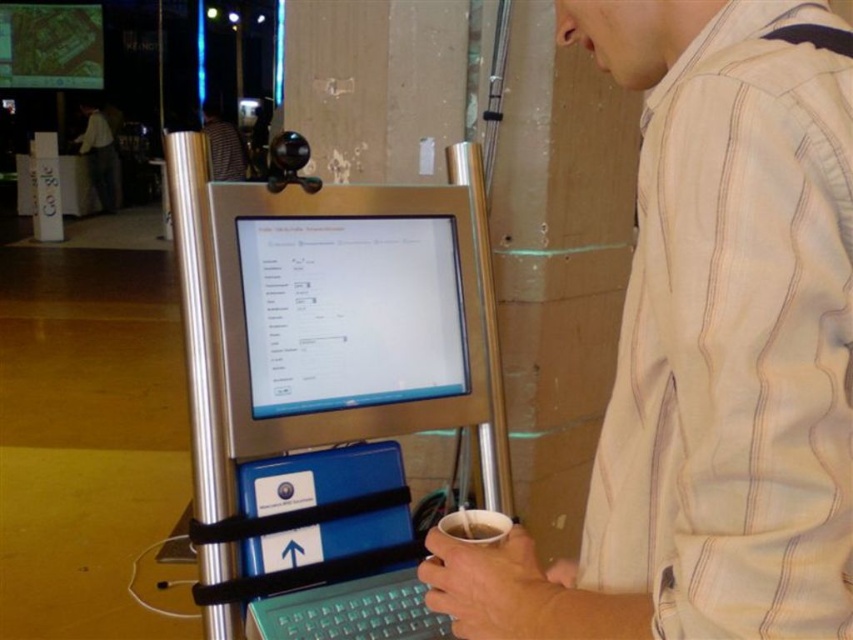
Question: Considering the relative positions of silver metallic computer at center and silver metallic computer monitor at center in the image provided, where is silver metallic computer at center located with respect to silver metallic computer monitor at center?

Choices:
 (A) left
 (B) right

Answer: (B)

Question: Which point appears farthest from the camera in this image?

Choices:
 (A) (227, 148)
 (B) (440, 524)
 (C) (200, 520)

Answer: (A)

Question: Which point is farther from the camera taking this photo?

Choices:
 (A) (468, 540)
 (B) (729, 483)
 (C) (204, 129)
 (D) (115, 168)

Answer: (D)

Question: Is silver metallic computer monitor at center behind light beige striped shirt at upper right?

Choices:
 (A) no
 (B) yes

Answer: (A)

Question: Based on their relative distances, which object is nearer to the light beige striped shirt at center?

Choices:
 (A) silver metallic computer monitor at center
 (B) striped shirt at center
 (C) light beige striped shirt at upper right
 (D) silver metallic computer at center

Answer: (D)

Question: Does silver metallic computer monitor at center have a greater width compared to matte plastic cup at lower center?

Choices:
 (A) no
 (B) yes

Answer: (B)